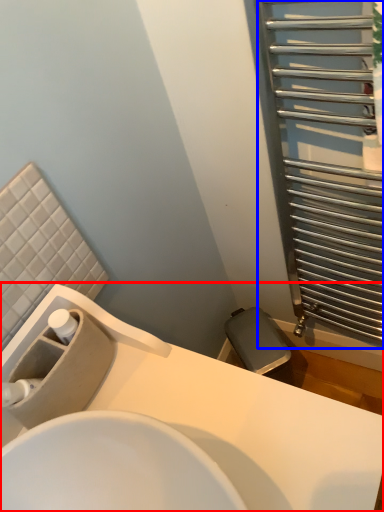
Question: Which point is further to the camera, sink (highlighted by a red box) or screen door (highlighted by a blue box)?

Choices:
 (A) sink
 (B) screen door

Answer: (B)